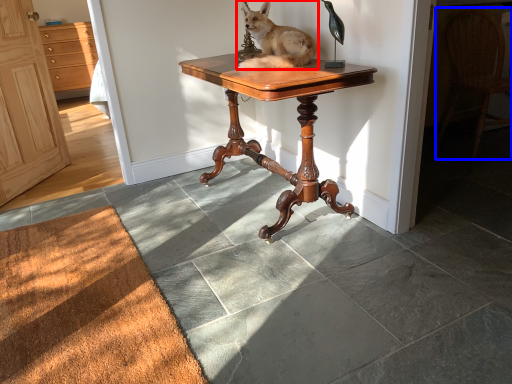
Question: Which of the following is the closest to the observer, dog (highlighted by a red box) or chair (highlighted by a blue box)?

Choices:
 (A) dog
 (B) chair

Answer: (A)